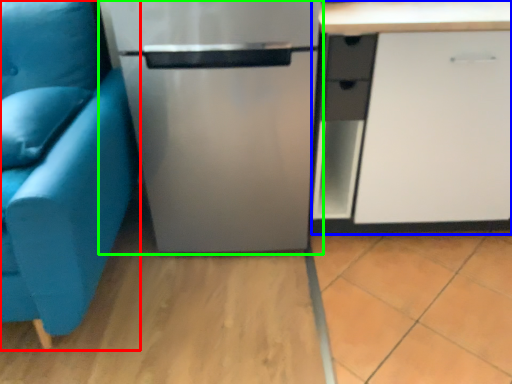
Question: Which is nearer to the studio couch (highlighted by a red box)? cabinetry (highlighted by a blue box) or refrigerator (highlighted by a green box).

Choices:
 (A) cabinetry
 (B) refrigerator

Answer: (B)